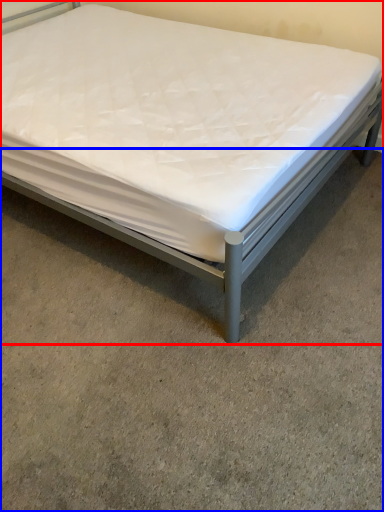
Question: Which object is closer to the camera taking this photo, bed (highlighted by a red box) or concrete (highlighted by a blue box)?

Choices:
 (A) bed
 (B) concrete

Answer: (B)